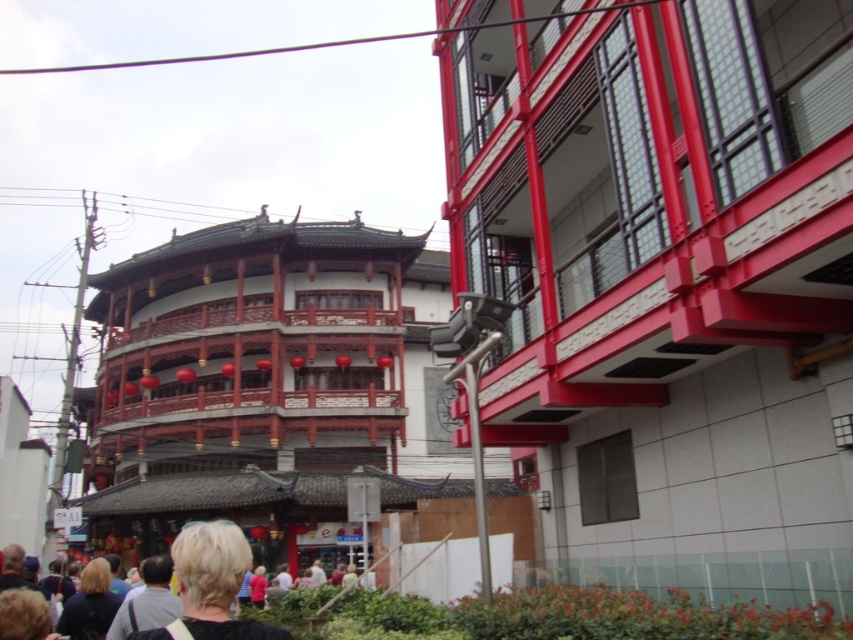
You are an architect visiting the city and notice the smooth red building at center and the blonde hair at lower left. Which object takes up more visual space in the image?

The smooth red building at center is bigger than blonde hair at lower left, so it takes up more visual space in the image.

You are a photographer standing in the middle of the urban scene. You want to capture a photo that includes both the smooth red building at center and the blonde hair at lower left. Based on their positions, which object should you adjust your camera angle to focus on first to ensure both are in the frame?

The smooth red building at center is located above the blonde hair at lower left. To include both in the frame, you should first focus on the smooth red building at center, as it is higher up, and then adjust the angle downward to include the blonde hair at lower left.